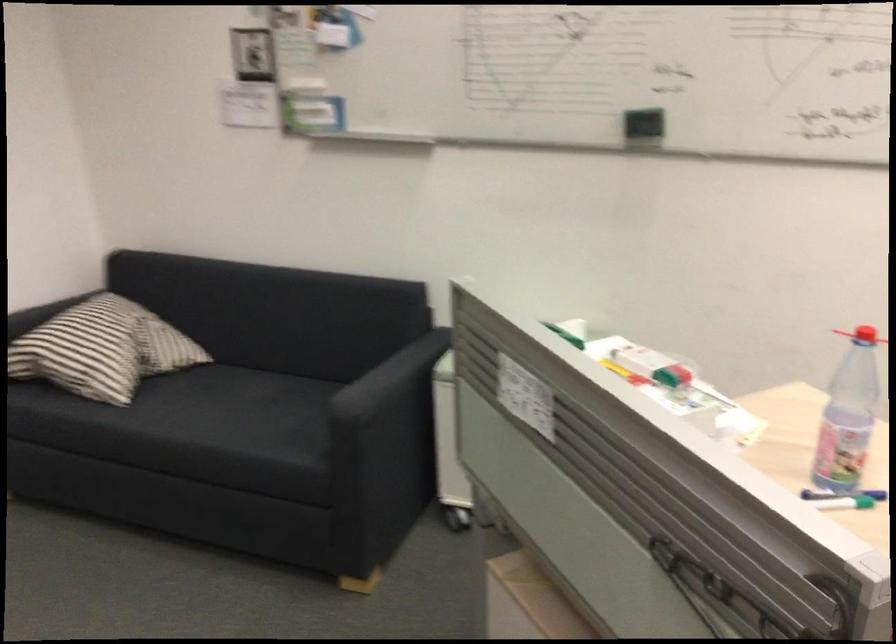
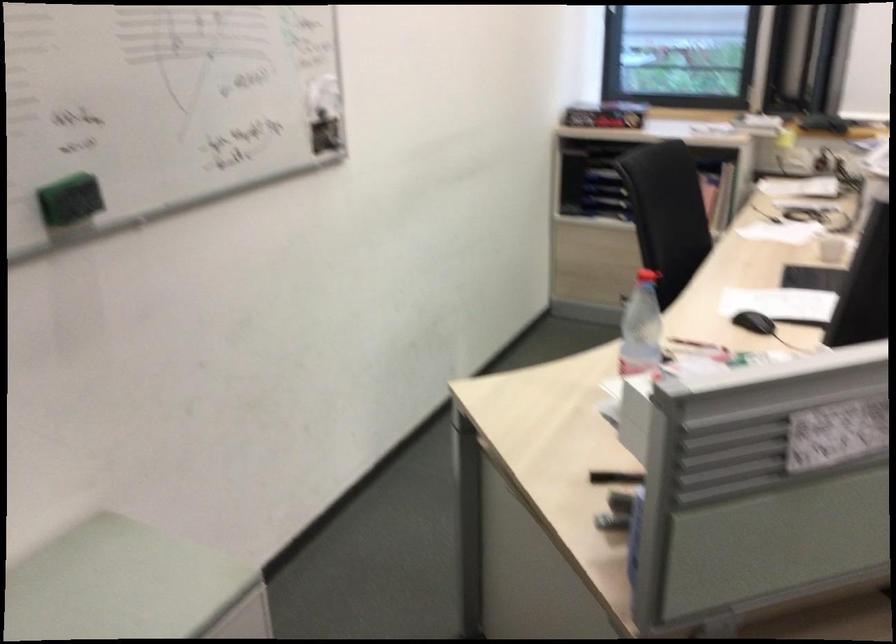
The point at (x=638, y=116) is marked in the first image. Where is the corresponding point in the second image?

(70, 200)